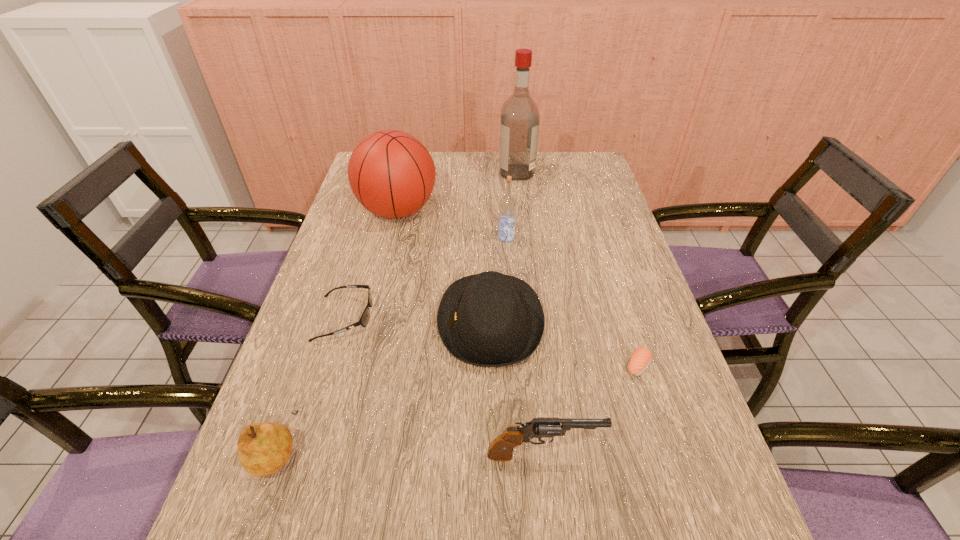
The height and width of the screenshot is (540, 960). What are the coordinates of `vacant region at the far right corner of the desktop` in the screenshot? It's located at (598, 178).

Identify the location of vacant space that is in between the shortest object and the gun. click(590, 410).

Image resolution: width=960 pixels, height=540 pixels. In order to click on unoccupied position between the shortest object and the gun in this screenshot , I will do `click(590, 410)`.

Find the location of a particular element. The height and width of the screenshot is (540, 960). vacant area that lies between the sushi and the tallest object is located at coordinates (577, 269).

You are a GUI agent. You are given a task and a screenshot of the screen. Output one action in this format:
    pyautogui.click(x=<x>, y=<y>)
    Task: Click on the unoccupied position between the seventh tallest object and the pear
    The height and width of the screenshot is (540, 960).
    Given the screenshot: What is the action you would take?
    pyautogui.click(x=310, y=384)

Locate an element on the screen. The width and height of the screenshot is (960, 540). the fourth closest object to the liquor is located at coordinates (364, 319).

Choose which object is the sixth nearest neighbor to the pear. Please provide its 2D coordinates. Your answer should be formatted as a tuple, i.e. [(x, y)], where the tuple contains the x and y coordinates of a point satisfying the conditions above.

[(507, 204)]

Locate an element on the screen. This screenshot has height=540, width=960. blank area in the image that satisfies the following two spatial constraints: 1. on the front-facing side of the farthest object; 2. on the front side of the pear is located at coordinates (549, 450).